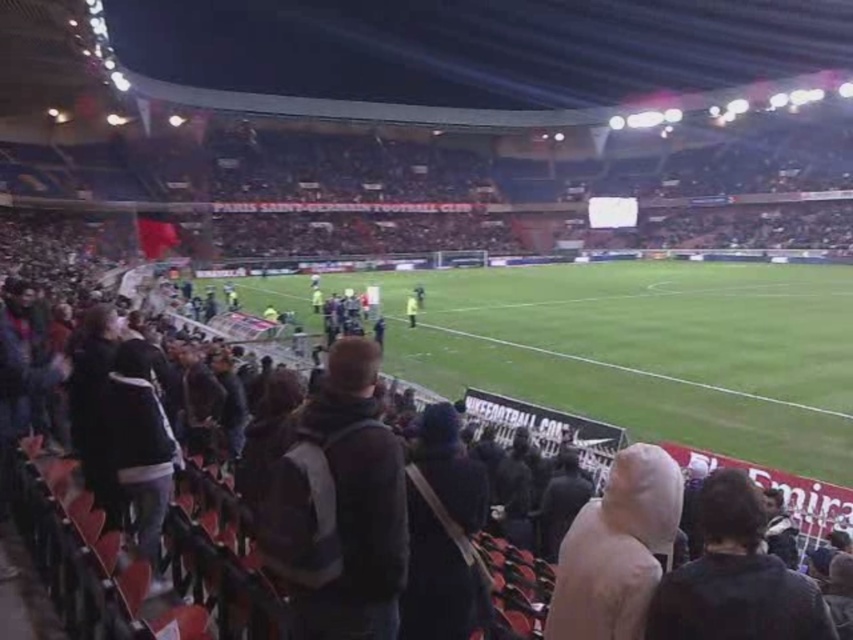
From the picture: You are a photographer positioned at the edge of the stadium. You need to capture a photo that includes both the green grass football field at center and the white matte hood at center. Based on their relative sizes, which object should appear larger in your photo?

The green grass football field at center might be wider than white matte hood at center, so it should appear larger in the photo.

You are a spectator at the football stadium and want to move from your current position to the concession stand located at point (350, 561). There is another spectator at point (614, 291). Can you pass behind them to reach the concession stand?

Point (614, 291) is behind point (350, 561), so you can pass behind them to reach the concession stand.

You are a spectator at the football stadium and want to place your dark gray backpack at center on the green grass football field at center. Will the backpack be visible from above once placed there?

The green grass football field at center is taller than dark gray backpack at center, so the backpack might be partially or fully hidden by the field when viewed from above.